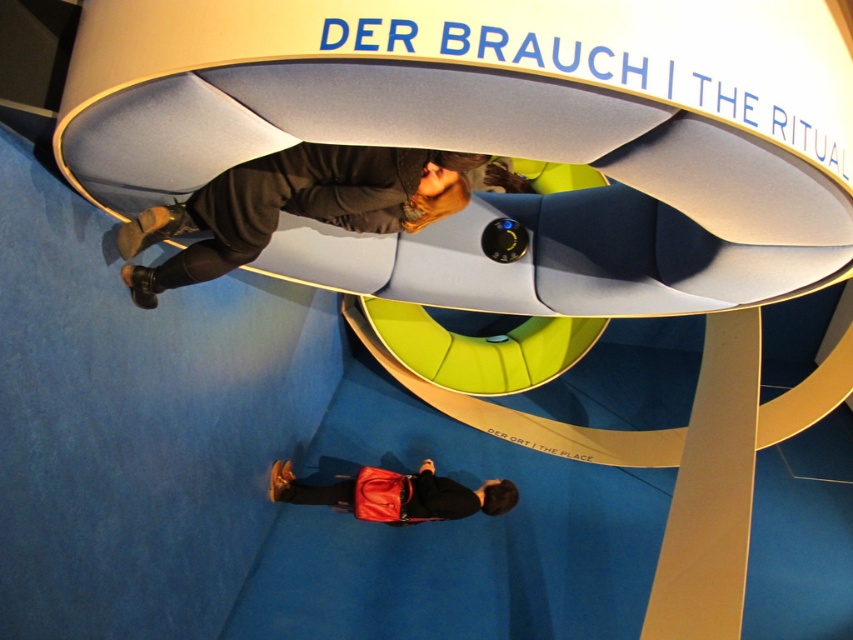
Question: Is dark gray hoodie at upper center above matte red bag at lower center?

Choices:
 (A) yes
 (B) no

Answer: (A)

Question: Is dark gray hoodie at upper center below matte red bag at lower center?

Choices:
 (A) no
 (B) yes

Answer: (A)

Question: Is dark gray hoodie at upper center bigger than matte red bag at lower center?

Choices:
 (A) yes
 (B) no

Answer: (A)

Question: Which point is closer to the camera?

Choices:
 (A) (263, 157)
 (B) (318, 490)

Answer: (A)

Question: Which point is closer to the camera?

Choices:
 (A) dark gray hoodie at upper center
 (B) matte red bag at lower center

Answer: (A)